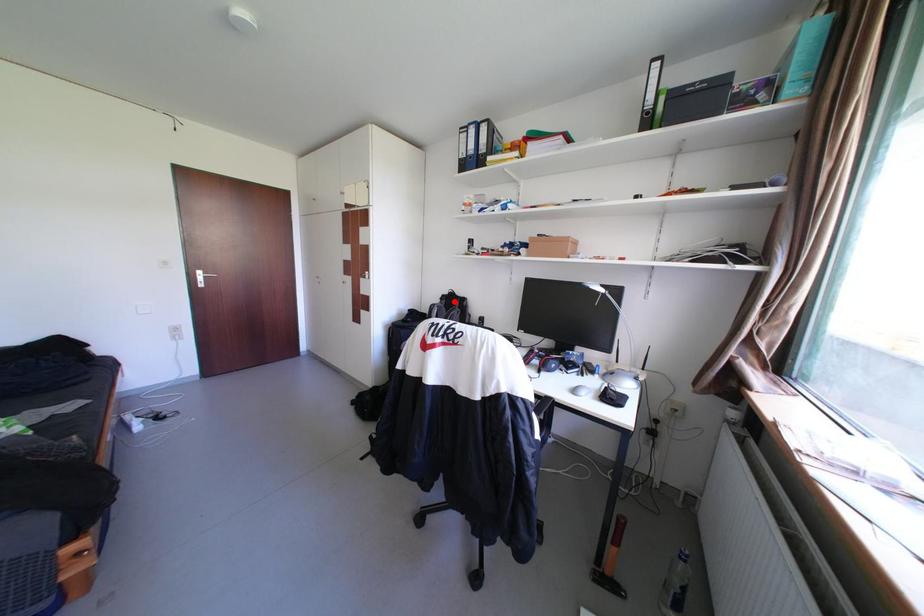
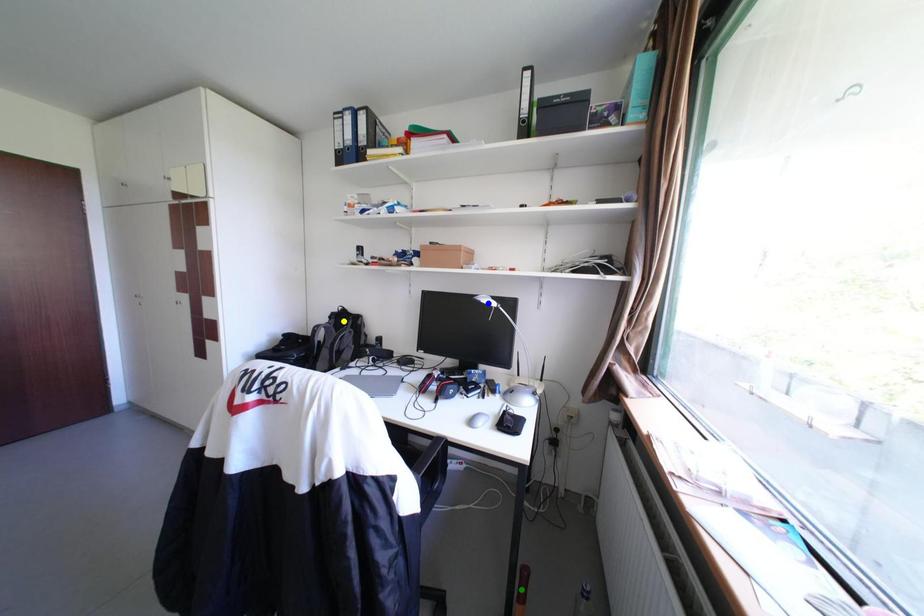
Question: I am providing you with two images of the same scene from different viewpoints. A red point is marked on the first image. You are given multiple points on the second image. In image 2, which mark is for the same physical point as the one in image 1?

Choices:
 (A) yellow point
 (B) blue point
 (C) green point

Answer: (A)